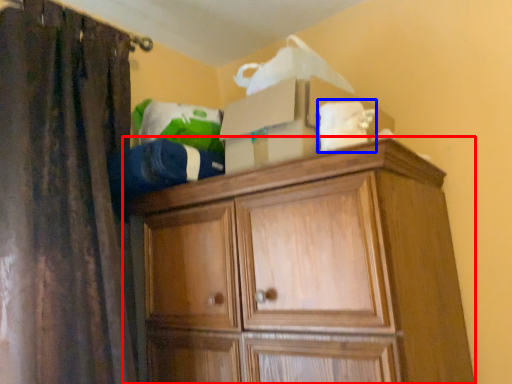
Question: Which object appears closest to the camera in this image, cupboard (highlighted by a red box) or clothing (highlighted by a blue box)?

Choices:
 (A) cupboard
 (B) clothing

Answer: (A)